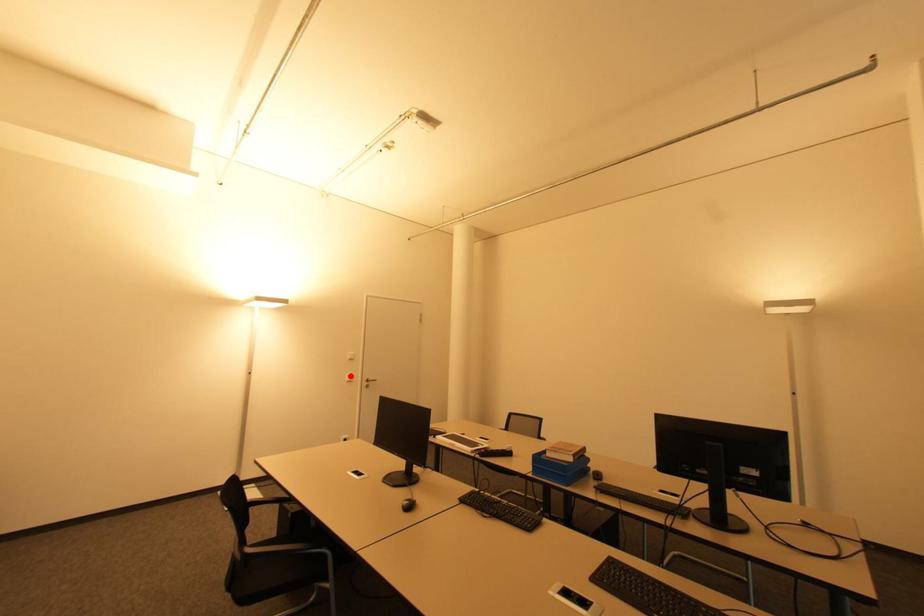
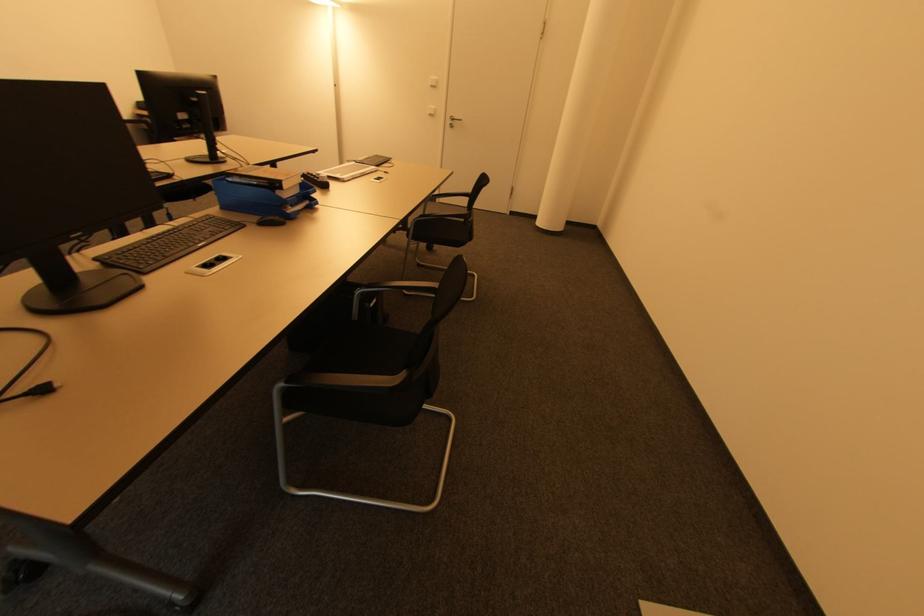
Question: I am providing you with two images of the same scene from different viewpoints. Given a red point in image1, look at the same physical point in image2. Is it:

Choices:
 (A) Closer to the viewpoint
 (B) Farther from the viewpoint

Answer: (A)